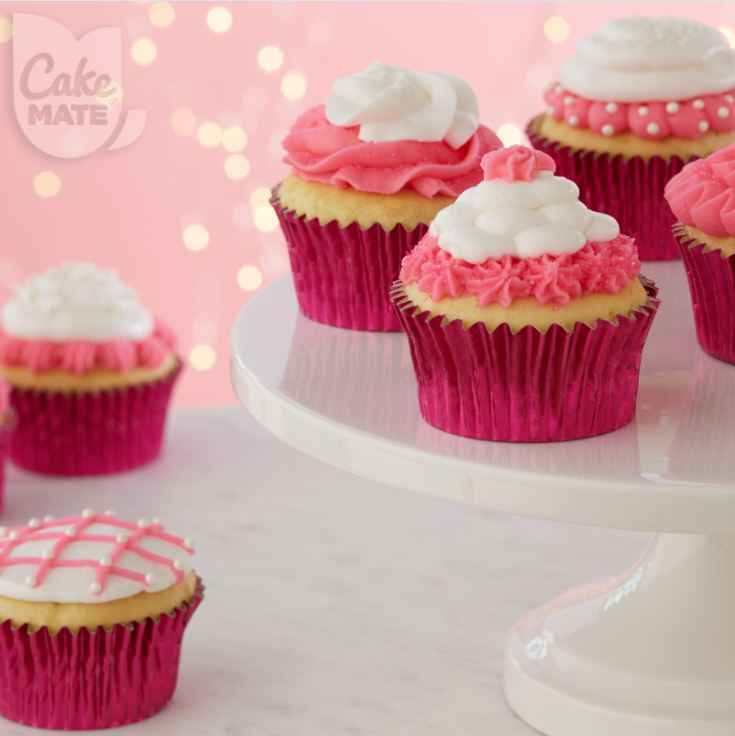
Find the location of a particular element. This screenshot has width=735, height=736. table is located at coordinates (390, 629).